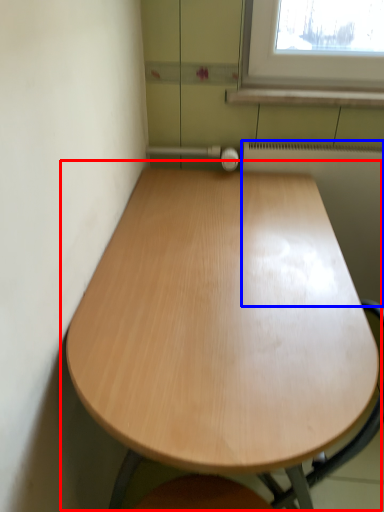
Question: Which point is closer to the camera, table (highlighted by a red box) or radiator (highlighted by a blue box)?

Choices:
 (A) table
 (B) radiator

Answer: (A)